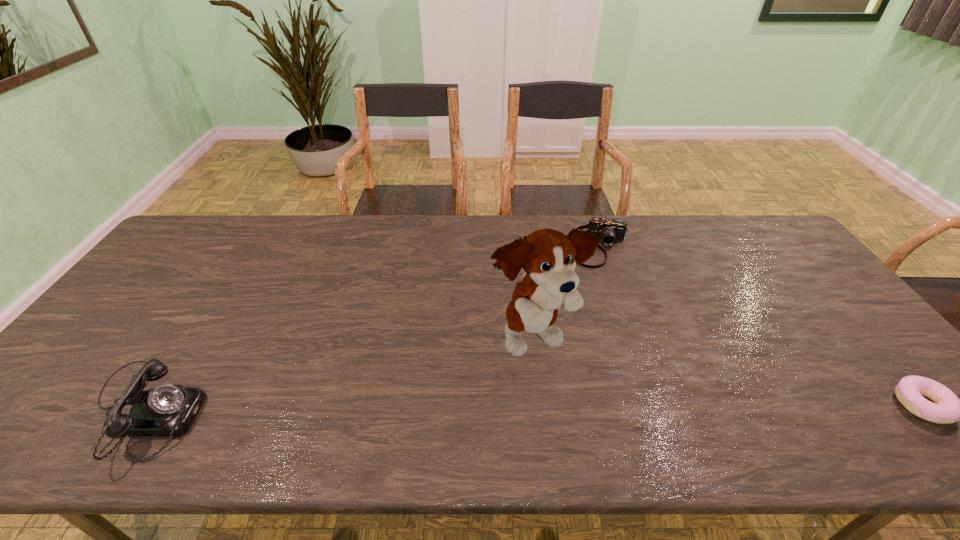
Locate an element on the screen. This screenshot has height=540, width=960. vacant space located 0.110m on the face of the tallest object is located at coordinates (600, 398).

At what (x,y) coordinates should I click in order to perform the action: click on object that is at the far edge. Please return your answer as a coordinate pair (x, y). Looking at the image, I should click on (609, 230).

Identify the location of object that is at the near edge. (166, 410).

Find the location of a particular element. Image resolution: width=960 pixels, height=540 pixels. object present at the left edge is located at coordinates (166, 410).

Locate an element on the screen. object that is at the near left corner is located at coordinates (166, 410).

At what (x,y) coordinates should I click in order to perform the action: click on vacant area at the far edge. Please return your answer as a coordinate pair (x, y). The width and height of the screenshot is (960, 540). Looking at the image, I should click on (290, 226).

This screenshot has width=960, height=540. In order to click on vacant space at the near edge in this screenshot , I will do `click(552, 392)`.

The height and width of the screenshot is (540, 960). Find the location of `blank space at the left edge of the desktop`. blank space at the left edge of the desktop is located at coordinates (144, 280).

The height and width of the screenshot is (540, 960). In the image, there is a desktop. Identify the location of blank space at the far left corner. (173, 248).

The image size is (960, 540). I want to click on vacant space at the near left corner of the desktop, so click(35, 404).